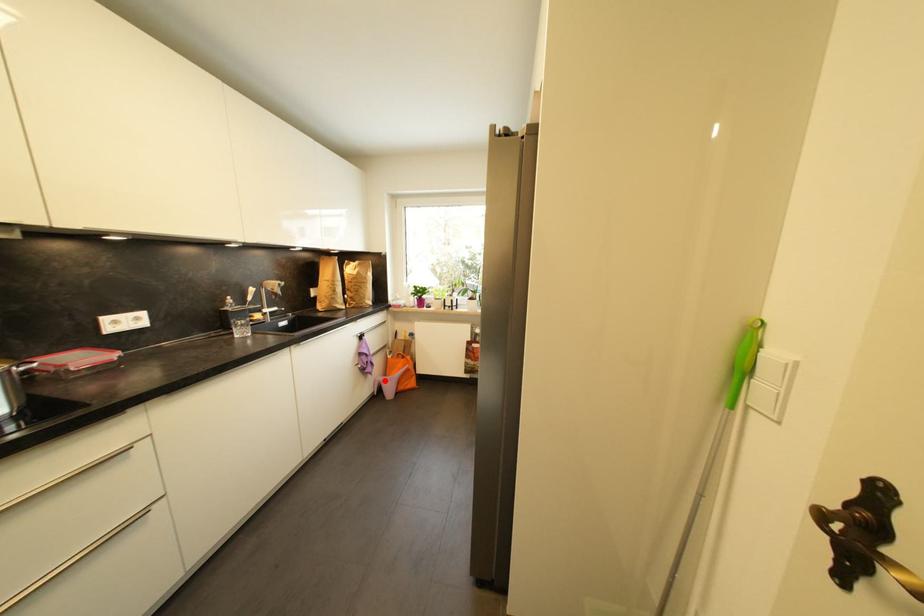
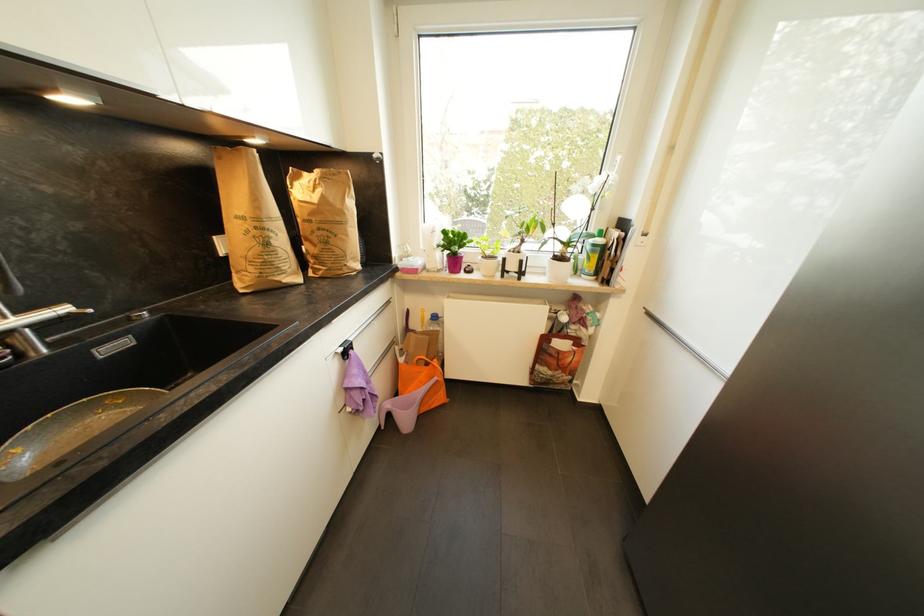
Question: I am providing you with two images of the same scene from different viewpoints. Given a red point in image1, look at the same physical point in image2. Is it:

Choices:
 (A) Closer to the viewpoint
 (B) Farther from the viewpoint

Answer: (A)